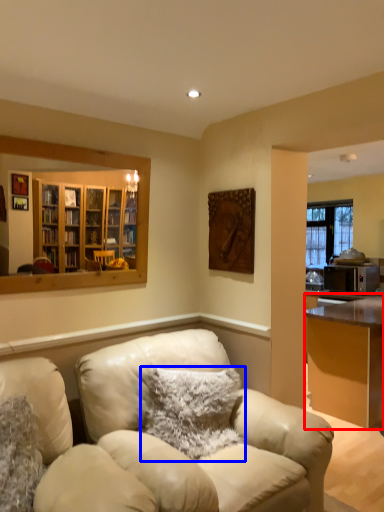
Question: Which of the following is the farthest to the observer, desk (highlighted by a red box) or pillow (highlighted by a blue box)?

Choices:
 (A) desk
 (B) pillow

Answer: (A)